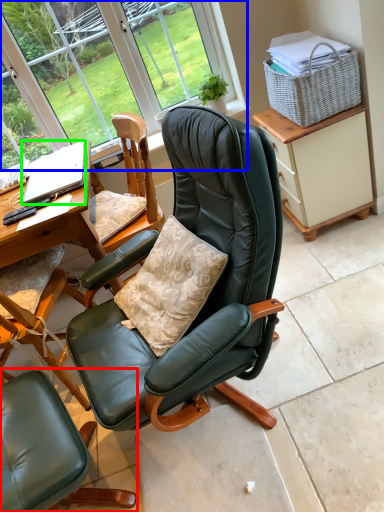
Question: Which object is positioned closest to chair (highlighted by a red box)? Select from bay window (highlighted by a blue box) and laptop (highlighted by a green box).

Choices:
 (A) bay window
 (B) laptop

Answer: (B)